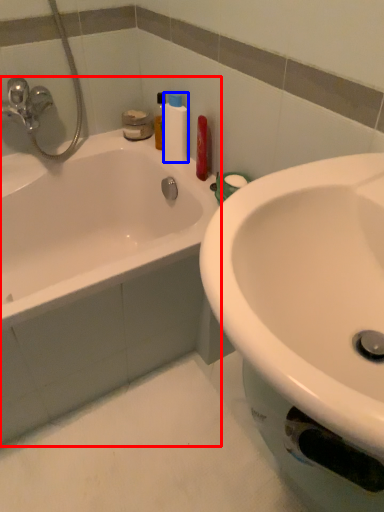
Question: Which point is closer to the camera, bathtub (highlighted by a red box) or cleaning product (highlighted by a blue box)?

Choices:
 (A) bathtub
 (B) cleaning product

Answer: (A)